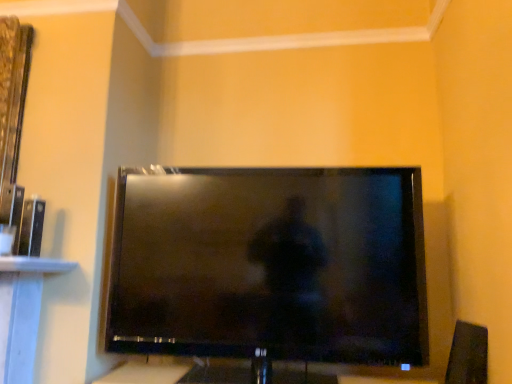
Question: Is black glossy tv at center shorter than black plastic speaker at lower right?

Choices:
 (A) no
 (B) yes

Answer: (A)

Question: Is the position of black glossy tv at center less distant than that of black plastic speaker at lower right?

Choices:
 (A) no
 (B) yes

Answer: (B)

Question: Is black plastic speaker at lower right inside black glossy tv at center?

Choices:
 (A) no
 (B) yes

Answer: (A)

Question: From the image's perspective, is black glossy tv at center located above black plastic speaker at lower right?

Choices:
 (A) no
 (B) yes

Answer: (B)

Question: Considering the relative positions of black glossy tv at center and black plastic speaker at lower right in the image provided, is black glossy tv at center to the left of black plastic speaker at lower right from the viewer's perspective?

Choices:
 (A) yes
 (B) no

Answer: (A)

Question: Is black glossy tv at center not close to black plastic speaker at lower right?

Choices:
 (A) yes
 (B) no

Answer: (B)

Question: From a real-world perspective, is black plastic speaker at lower right under black glossy tv at center?

Choices:
 (A) no
 (B) yes

Answer: (B)

Question: Considering the relative sizes of black plastic speaker at lower right and black glossy tv at center in the image provided, is black plastic speaker at lower right thinner than black glossy tv at center?

Choices:
 (A) no
 (B) yes

Answer: (B)

Question: Is black plastic speaker at lower right taller than black glossy tv at center?

Choices:
 (A) no
 (B) yes

Answer: (A)

Question: From a real-world perspective, is black plastic speaker at lower right located higher than black glossy tv at center?

Choices:
 (A) no
 (B) yes

Answer: (A)

Question: Is black plastic speaker at lower right positioned beyond the bounds of black glossy tv at center?

Choices:
 (A) no
 (B) yes

Answer: (B)

Question: Is black plastic speaker at lower right to the left of black glossy tv at center from the viewer's perspective?

Choices:
 (A) yes
 (B) no

Answer: (B)

Question: Is black glossy tv at center to the left or to the right of black plastic speaker at lower right in the image?

Choices:
 (A) right
 (B) left

Answer: (B)